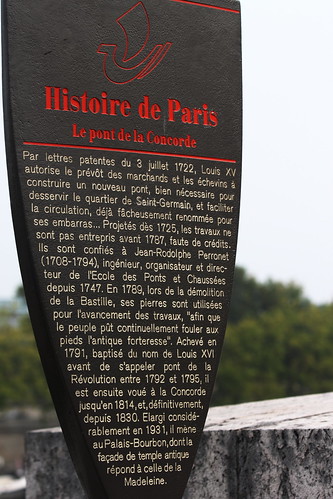
Locate an element on the screen. The height and width of the screenshot is (499, 333). grey wall edge is located at coordinates (207, 472).